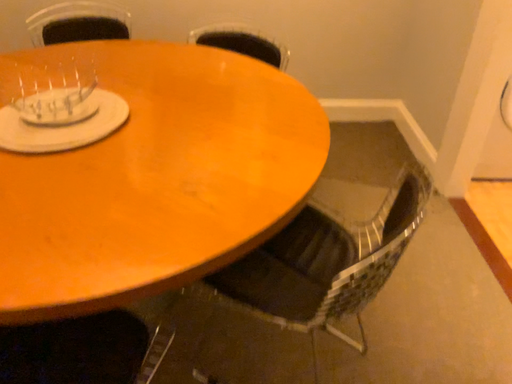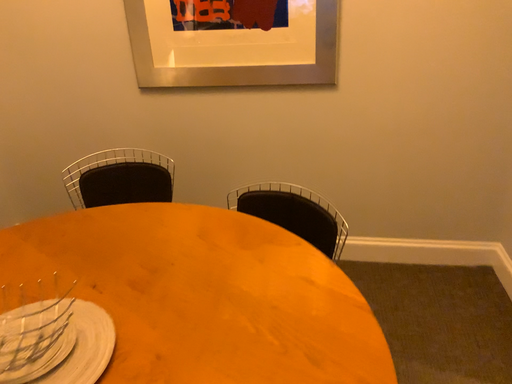
Question: Which way did the camera rotate in the video?

Choices:
 (A) rotated right
 (B) rotated left

Answer: (B)